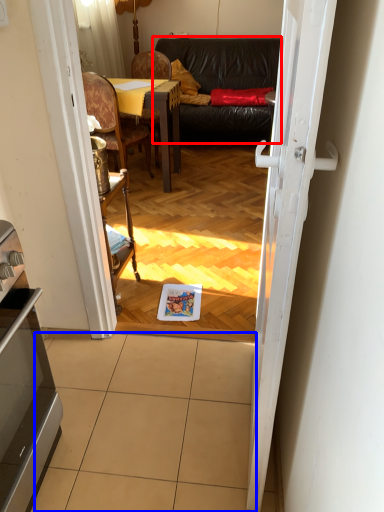
Question: Which point is closer to the camera, studio couch (highlighted by a red box) or tile (highlighted by a blue box)?

Choices:
 (A) studio couch
 (B) tile

Answer: (B)